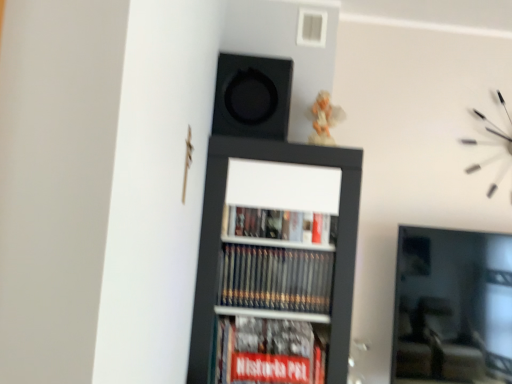
Question: Is point (473, 112) closer or farther from the camera than point (244, 104)?

Choices:
 (A) closer
 (B) farther

Answer: (B)

Question: In the image, is white matte clock at upper right positioned in front of or behind black matte speaker at upper center?

Choices:
 (A) front
 (B) behind

Answer: (B)

Question: Which object is the closest to the black matte speaker at upper center?

Choices:
 (A) black matte bookcase at center
 (B) white matte clock at upper right

Answer: (A)

Question: Based on their relative distances, which object is nearer to the white matte clock at upper right?

Choices:
 (A) black matte speaker at upper center
 (B) black matte bookcase at center

Answer: (B)